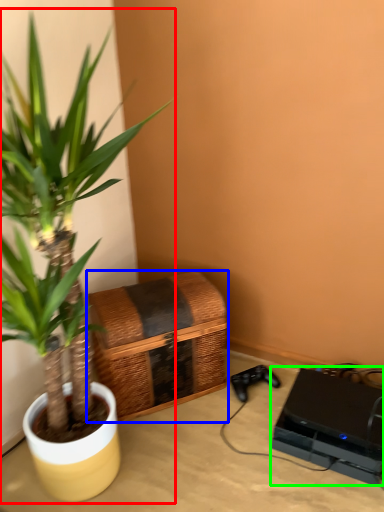
Question: Estimate the real-world distances between objects in this image. Which object is closer to houseplant (highlighted by a red box), basket (highlighted by a blue box) or computer (highlighted by a green box)?

Choices:
 (A) basket
 (B) computer

Answer: (A)